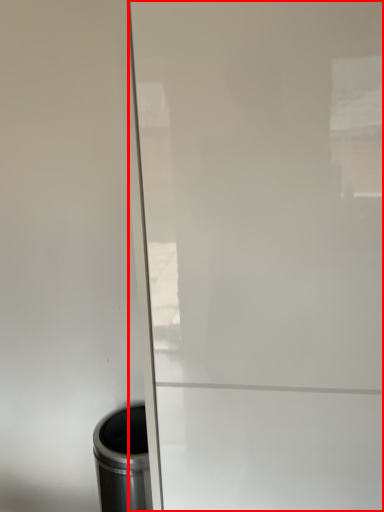
Question: From the image's perspective, where is screen door (annotated by the red box) located in relation to waste container in the image?

Choices:
 (A) below
 (B) above

Answer: (B)